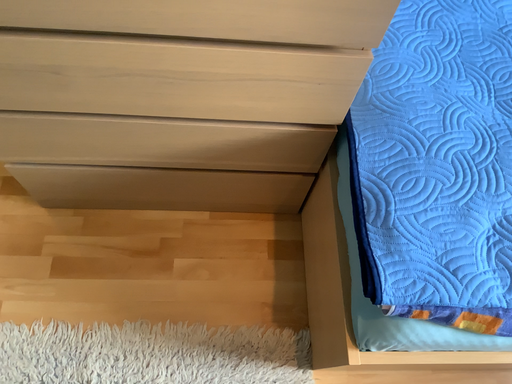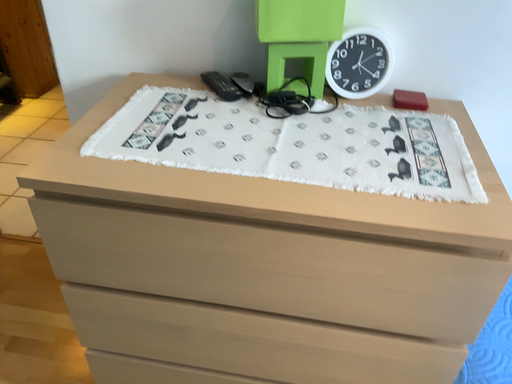
Question: How did the camera likely rotate when shooting the video?

Choices:
 (A) rotated left
 (B) rotated right

Answer: (A)